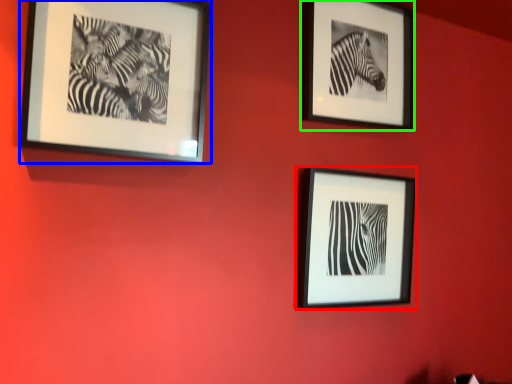
Question: Which object is positioned farthest from picture frame (highlighted by a red box)? Select from picture frame (highlighted by a blue box) and picture frame (highlighted by a green box).

Choices:
 (A) picture frame
 (B) picture frame

Answer: (A)